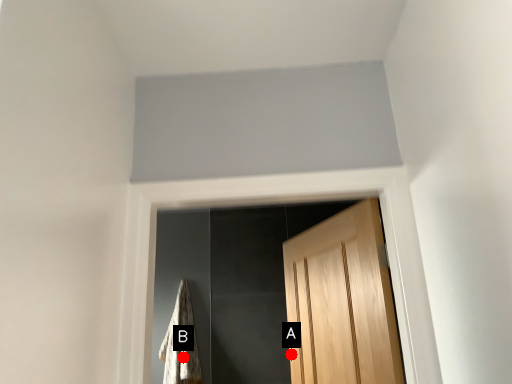
Question: Two points are circled on the image, labeled by A and B beside each circle. Among these points, which one is nearest to the camera?

Choices:
 (A) A is closer
 (B) B is closer

Answer: (A)